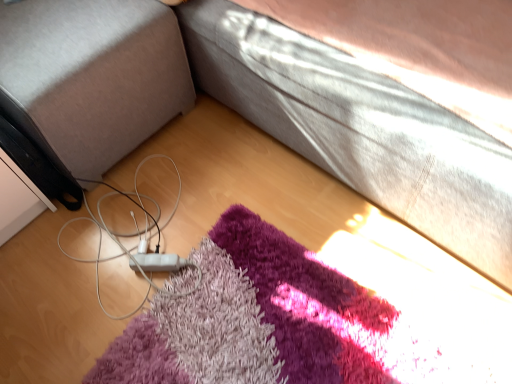
At what (x,y) coordinates should I click in order to perform the action: click on free spot to the right of white matte cable at lower left. Please return your answer as a coordinate pair (x, y). The height and width of the screenshot is (384, 512). Looking at the image, I should click on (276, 237).